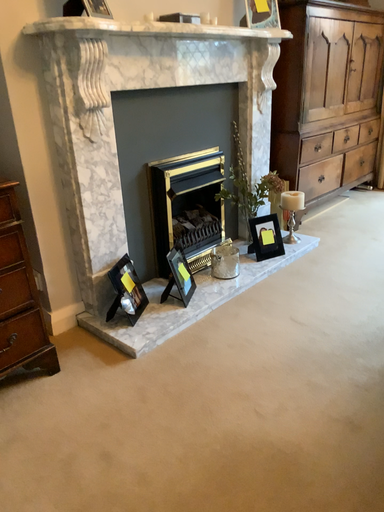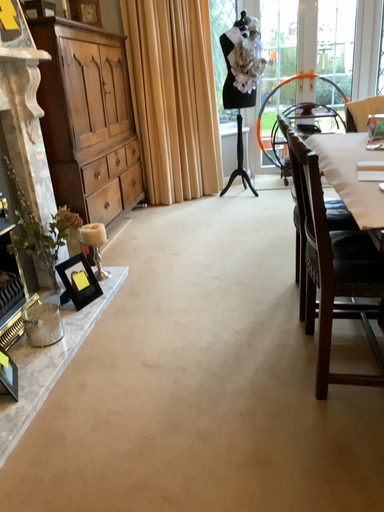
Question: Which way did the camera rotate in the video?

Choices:
 (A) rotated downward
 (B) rotated upward

Answer: (B)